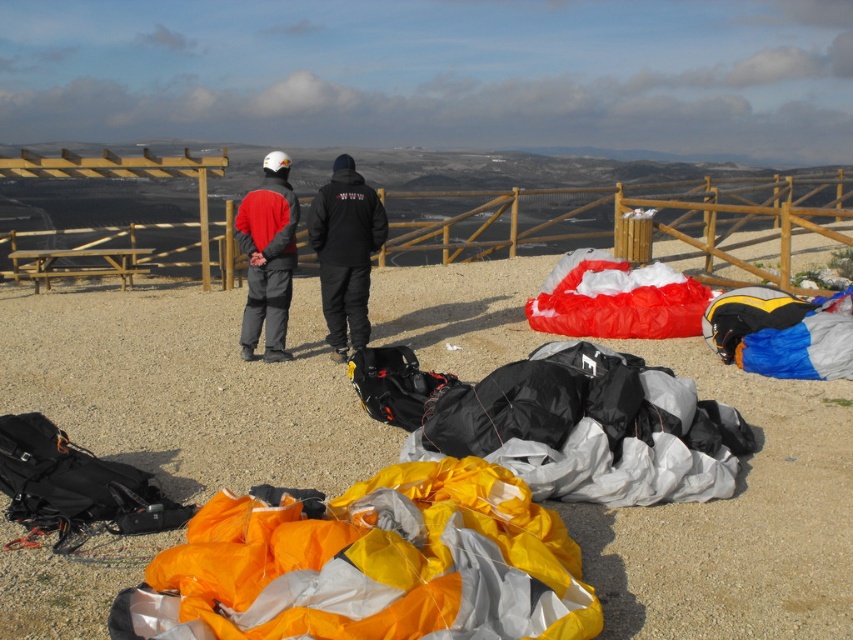
Question: From the image, what is the correct spatial relationship of orange fabric parachute at center in relation to orange fabric parachute at lower center?

Choices:
 (A) below
 (B) above

Answer: (B)

Question: Does black fabric parachute at center come in front of matte red jacket at center?

Choices:
 (A) yes
 (B) no

Answer: (A)

Question: Among these objects, which one is farthest from the camera?

Choices:
 (A) black matte jacket at center
 (B) orange fabric parachute at center
 (C) black fabric parachute at center

Answer: (A)

Question: Can you confirm if orange fabric parachute at lower center is positioned to the right of black fabric parachute at center?

Choices:
 (A) yes
 (B) no

Answer: (B)

Question: Estimate the real-world distances between objects in this image. Which object is farther from the black matte jacket at center?

Choices:
 (A) orange fabric parachute at lower center
 (B) black fabric parachute at center
 (C) wooden fence at upper center

Answer: (C)

Question: Which point is closer to the camera taking this photo?

Choices:
 (A) (291, 198)
 (B) (479, 416)
 (C) (381, 253)
 (D) (509, 580)

Answer: (D)